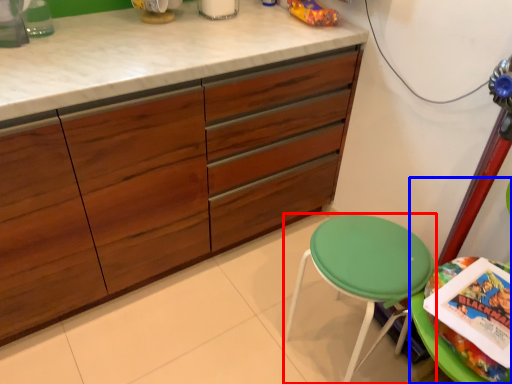
Question: Which point is closer to the camera, stool (highlighted by a red box) or swivel chair (highlighted by a blue box)?

Choices:
 (A) stool
 (B) swivel chair

Answer: (B)